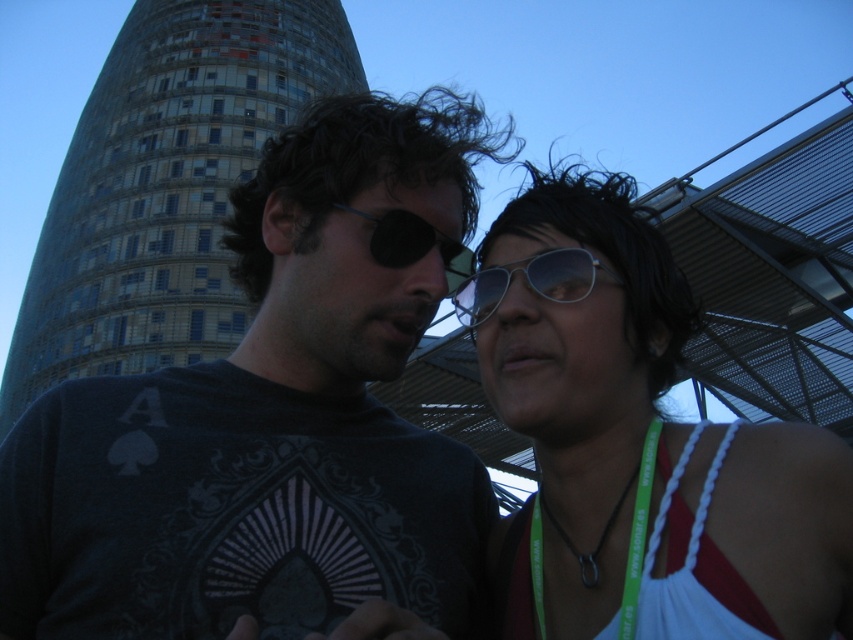
Does silver metallic aviator sunglasses at center have a lesser height compared to black plastic eye patch at center?

Yes, silver metallic aviator sunglasses at center is shorter than black plastic eye patch at center.

Which is behind, point (556, 276) or point (372, 234)?

The point (372, 234) is behind.

Does point (474, 307) come farther from viewer compared to point (413, 259)?

Yes, it is.

Identify the location of silver metallic aviator sunglasses at center. This screenshot has width=853, height=640. coord(529,282).

Is dark gray t-shirt at center smaller than silver metallic aviator sunglasses at center?

Incorrect, dark gray t-shirt at center is not smaller in size than silver metallic aviator sunglasses at center.

Is dark gray t-shirt at center to the left of silver metallic aviator sunglasses at center from the viewer's perspective?

Yes, dark gray t-shirt at center is to the left of silver metallic aviator sunglasses at center.

I want to click on dark gray t-shirt at center, so click(273, 413).

Does dark gray t-shirt at center have a smaller size compared to black plastic eye patch at center?

Incorrect, dark gray t-shirt at center is not smaller in size than black plastic eye patch at center.

Which is more to the left, dark gray t-shirt at center or black plastic eye patch at center?

dark gray t-shirt at center is more to the left.

Does point (364, 564) lie in front of point (384, 237)?

Yes.

Find the location of a particular element. This screenshot has width=853, height=640. dark gray t-shirt at center is located at coordinates (273, 413).